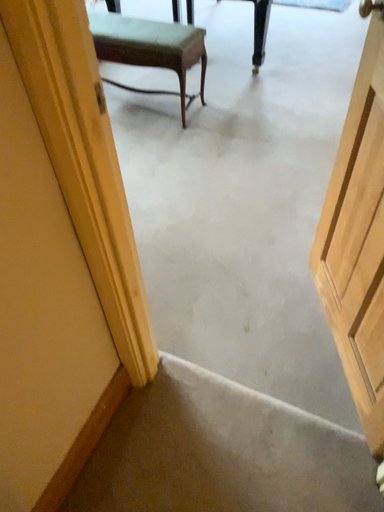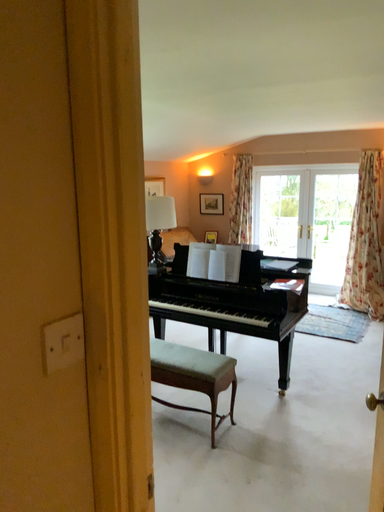
Question: Which way did the camera rotate in the video?

Choices:
 (A) rotated upward
 (B) rotated downward

Answer: (A)